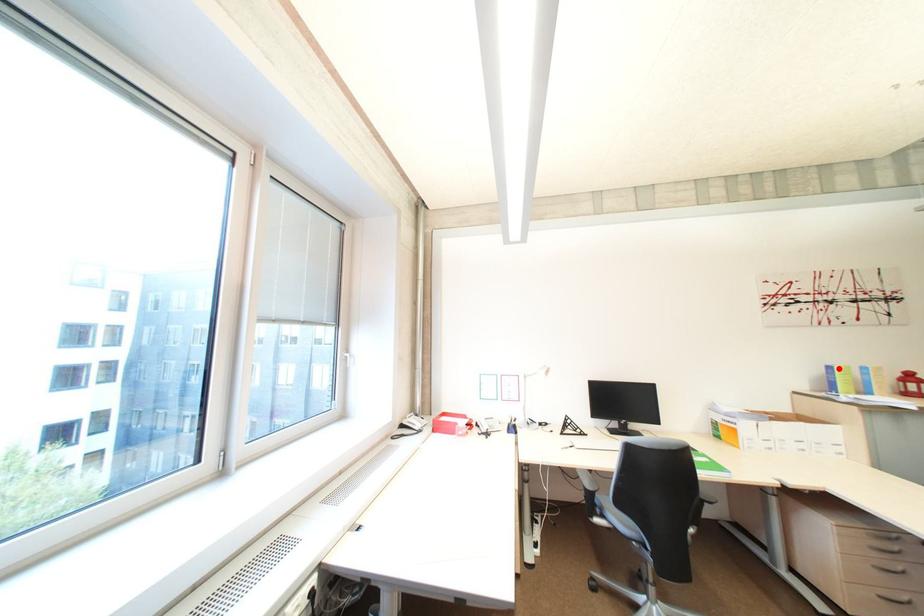
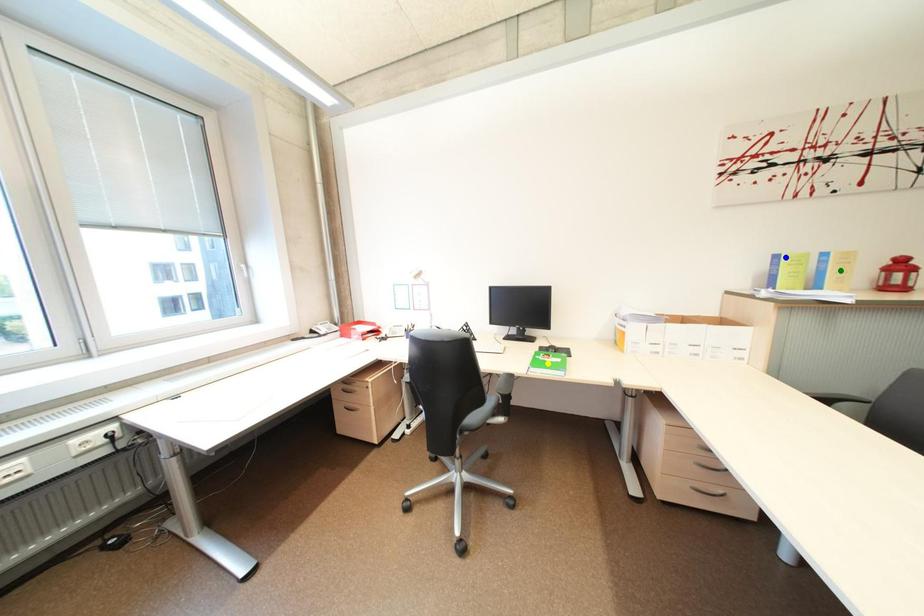
Question: I am providing you with two images of the same scene from different viewpoints. A red point is marked on the first image. You are given multiple points on the second image. Which point in image 2 represents the same 3d spot as the red point in image 1?

Choices:
 (A) blue point
 (B) yellow point
 (C) green point

Answer: (A)